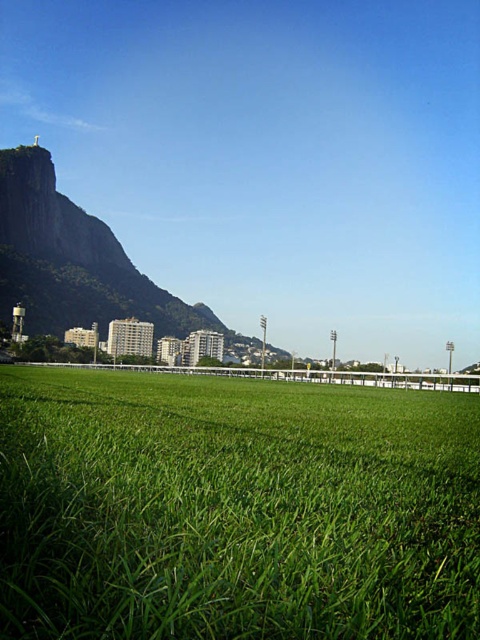
Is point (45, 616) positioned after point (31, 180)?

No, (45, 616) is closer to viewer.

Which is in front, point (123, 461) or point (29, 225)?

Point (123, 461) is more forward.

Does point (313, 624) come behind point (121, 308)?

No, (313, 624) is in front of (121, 308).

The image size is (480, 640). In order to click on green grass at center in this screenshot , I will do `click(235, 509)`.